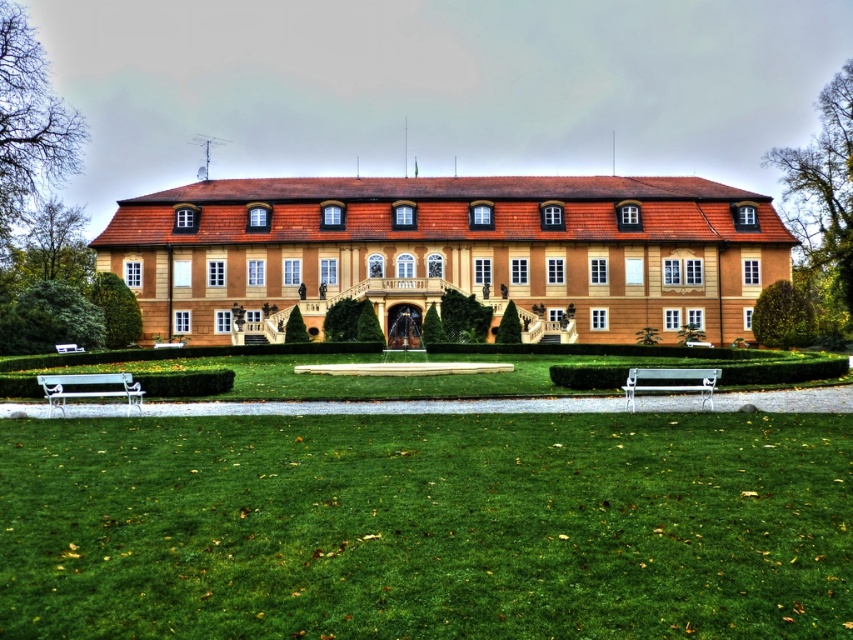
You are a gardener who wants to mow the lawn. You see the green grass at lower center and the white metallic bench at lower center. Which object is taller and needs to be moved before mowing?

The green grass at lower center is taller than the white metallic bench at lower center, so you should move the green grass at lower center before mowing.

You are standing at the entrance of the grand building and want to sit down to enjoy the garden view. Which object at point [670,381] should you approach?

The white metallic bench at lower center is located at point [670,381], so you should approach the white metallic bench at lower center to sit down and enjoy the garden view.